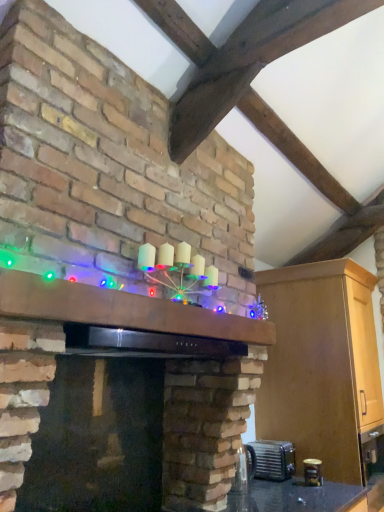
The width and height of the screenshot is (384, 512). Describe the element at coordinates (239, 56) in the screenshot. I see `matte black exhaust hood at upper center` at that location.

Measure the distance between point (x=283, y=447) and camera.

Point (x=283, y=447) and camera are 2.75 meters apart.

Describe the element at coordinates (121, 310) in the screenshot. I see `illuminated wooden mantle at center` at that location.

At what (x,y) coordinates should I click in order to perform the action: click on illuminated wooden mantle at center. Please return your answer as a coordinate pair (x, y). Looking at the image, I should click on (121, 310).

The height and width of the screenshot is (512, 384). What are the coordinates of `matte black exhaust hood at upper center` in the screenshot? It's located at (239, 56).

Is metallic silver toaster at lower right, the second appliance in the right-to-left sequence, not inside matte brick fireplace at center?

metallic silver toaster at lower right, the second appliance in the right-to-left sequence, lies outside matte brick fireplace at center's area.

Looking at their sizes, would you say metallic silver toaster at lower right, placed as the second appliance when sorted from back to front, is wider or thinner than matte brick fireplace at center?

Clearly, metallic silver toaster at lower right, placed as the second appliance when sorted from back to front, has less width compared to matte brick fireplace at center.

From the image's perspective, which one is positioned higher, metallic silver toaster at lower right, which is counted as the 1th appliance, starting from the front, or matte brick fireplace at center?

matte brick fireplace at center is shown above in the image.

Looking at this image, is matte black exhaust hood at upper center spatially inside metallic silver toaster at lower right, placed as the second appliance when sorted from back to front, or outside of it?

matte black exhaust hood at upper center cannot be found inside metallic silver toaster at lower right, placed as the second appliance when sorted from back to front.

Is matte black exhaust hood at upper center wider or thinner than metallic silver toaster at lower right, placed as the second appliance when sorted from back to front?

Considering their sizes, matte black exhaust hood at upper center looks broader than metallic silver toaster at lower right, placed as the second appliance when sorted from back to front.

Considering the points (264, 10) and (254, 459), which point is in front, point (264, 10) or point (254, 459)?

Point (264, 10)

From a real-world perspective, is matte black exhaust hood at upper center below metallic silver toaster at lower right, placed as the 1th appliance when sorted from left to right?

No.

Does matte black exhaust hood at upper center touch matte brick fireplace at center?

No, matte black exhaust hood at upper center is not next to matte brick fireplace at center.

From a real-world perspective, is matte black exhaust hood at upper center physically located above or below matte brick fireplace at center?

matte black exhaust hood at upper center is situated higher than matte brick fireplace at center in the real world.

The height and width of the screenshot is (512, 384). Find the location of `fireplace in front of the matte black exhaust hood at upper center`. fireplace in front of the matte black exhaust hood at upper center is located at coordinates (114, 285).

Is matte black exhaust hood at upper center oriented away from matte brick fireplace at center?

No, matte black exhaust hood at upper center is not facing away from matte brick fireplace at center.

Is metallic silver toaster at lower right, the 2th appliance viewed from the left, bigger than matte black exhaust hood at upper center?

Incorrect, metallic silver toaster at lower right, the 2th appliance viewed from the left, is not larger than matte black exhaust hood at upper center.

Can you confirm if metallic silver toaster at lower right, the 2th appliance viewed from the left, is wider than matte black exhaust hood at upper center?

Correct, the width of metallic silver toaster at lower right, the 2th appliance viewed from the left, exceeds that of matte black exhaust hood at upper center.

Are metallic silver toaster at lower right, the 2th appliance viewed from the left, and matte black exhaust hood at upper center located far from each other?

Indeed, metallic silver toaster at lower right, the 2th appliance viewed from the left, is not near matte black exhaust hood at upper center.

Looking at this image, measure the distance from metallic silver toaster at lower right, the 2th appliance viewed from the left, to matte black exhaust hood at upper center.

metallic silver toaster at lower right, the 2th appliance viewed from the left, is 7.28 feet from matte black exhaust hood at upper center.

Is there a large distance between matte brick fireplace at center and illuminated wooden mantle at center?

Actually, matte brick fireplace at center and illuminated wooden mantle at center are a little close together.

Visually, is matte brick fireplace at center positioned to the left or to the right of illuminated wooden mantle at center?

From the image, it's evident that matte brick fireplace at center is to the left of illuminated wooden mantle at center.

From the image's perspective, which is above, matte brick fireplace at center or illuminated wooden mantle at center?

matte brick fireplace at center, from the image's perspective.

Which appliance is the 1st one when counting from the back of the matte black exhaust hood at upper center? Please provide its 2D coordinates.

[(244, 470)]

Is metallic silver toaster at lower right, placed as the 1th appliance when sorted from left to right, facing towards matte black exhaust hood at upper center?

No.

From a real-world perspective, is metallic silver toaster at lower right, the second appliance in the right-to-left sequence, positioned under matte black exhaust hood at upper center based on gravity?

Correct, in the physical world, metallic silver toaster at lower right, the second appliance in the right-to-left sequence, is lower than matte black exhaust hood at upper center.

Which is closer, (237, 478) or (188, 32)?

Positioned in front is point (188, 32).

From the image's perspective, is illuminated wooden mantle at center under metallic silver toaster at lower right, the 2th appliance viewed from the left?

No, from the image's perspective, illuminated wooden mantle at center is not below metallic silver toaster at lower right, the 2th appliance viewed from the left.

Is illuminated wooden mantle at center oriented away from metallic silver toaster at lower right, the 2th appliance viewed from the left?

No, illuminated wooden mantle at center's orientation is not away from metallic silver toaster at lower right, the 2th appliance viewed from the left.

Does illuminated wooden mantle at center have a greater width compared to metallic silver toaster at lower right, the 2th appliance viewed from the left?

Incorrect, the width of illuminated wooden mantle at center does not surpass that of metallic silver toaster at lower right, the 2th appliance viewed from the left.

How many degrees apart are the facing directions of illuminated wooden mantle at center and metallic silver toaster at lower right, placed as the 1th appliance when sorted from back to front?

0.0635 degrees separate the facing orientations of illuminated wooden mantle at center and metallic silver toaster at lower right, placed as the 1th appliance when sorted from back to front.

Image resolution: width=384 pixels, height=512 pixels. Find the location of `fireplace lying on the left of metallic silver toaster at lower right, placed as the second appliance when sorted from back to front`. fireplace lying on the left of metallic silver toaster at lower right, placed as the second appliance when sorted from back to front is located at coordinates (114, 285).

From the image's perspective, count 1st appliances downward from the matte black exhaust hood at upper center and point to it. Please provide its 2D coordinates.

[(244, 470)]

Which object lies nearer to the anchor point matte brick fireplace at center, metallic silver toaster at lower right, placed as the 1th appliance when sorted from back to front, or matte black exhaust hood at upper center?

matte black exhaust hood at upper center.

When comparing their distances from metallic silver toaster at lower right, which appears as the 2th appliance when viewed from the front, does matte black exhaust hood at upper center or metallic silver toaster at lower right, which is counted as the 1th appliance, starting from the front, seem further?

Among the two, matte black exhaust hood at upper center is located further to metallic silver toaster at lower right, which appears as the 2th appliance when viewed from the front.

Which object lies nearer to the anchor point metallic silver toaster at lower right, which appears as the 2th appliance when viewed from the front, metallic silver toaster at lower right, the second appliance in the right-to-left sequence, or illuminated wooden mantle at center?

Based on the image, metallic silver toaster at lower right, the second appliance in the right-to-left sequence, appears to be nearer to metallic silver toaster at lower right, which appears as the 2th appliance when viewed from the front.

Based on their spatial positions, is matte brick fireplace at center or metallic silver toaster at lower right, which appears as the 2th appliance when viewed from the front, closer to metallic silver toaster at lower right, the second appliance in the right-to-left sequence?

metallic silver toaster at lower right, which appears as the 2th appliance when viewed from the front, lies closer to metallic silver toaster at lower right, the second appliance in the right-to-left sequence, than the other object.

From the image, which object appears to be farther from metallic silver toaster at lower right, the second appliance in the right-to-left sequence, matte black exhaust hood at upper center or matte brick fireplace at center?

matte black exhaust hood at upper center lies further to metallic silver toaster at lower right, the second appliance in the right-to-left sequence, than the other object.

Based on their spatial positions, is matte brick fireplace at center or matte black exhaust hood at upper center closer to illuminated wooden mantle at center?

Among the two, matte brick fireplace at center is located nearer to illuminated wooden mantle at center.

Which object lies nearer to the anchor point matte brick fireplace at center, metallic silver toaster at lower right, placed as the second appliance when sorted from back to front, or illuminated wooden mantle at center?

illuminated wooden mantle at center lies closer to matte brick fireplace at center than the other object.

Considering their positions, is matte black exhaust hood at upper center positioned closer to illuminated wooden mantle at center than metallic silver toaster at lower right, the 2th appliance viewed from the left?

Based on the image, matte black exhaust hood at upper center appears to be nearer to illuminated wooden mantle at center.

Locate an element on the screen. The image size is (384, 512). appliance between illuminated wooden mantle at center and metallic silver toaster at lower right, which is the 1th appliance in right-to-left order, from front to back is located at coordinates (244, 470).

Identify the location of fireplace between matte black exhaust hood at upper center and illuminated wooden mantle at center vertically. click(114, 285).

Identify the location of mantle located between matte brick fireplace at center and metallic silver toaster at lower right, placed as the second appliance when sorted from back to front, in the depth direction. The width and height of the screenshot is (384, 512). (121, 310).

Locate an element on the screen. mantle between matte brick fireplace at center and metallic silver toaster at lower right, placed as the 1th appliance when sorted from back to front, along the z-axis is located at coordinates (121, 310).